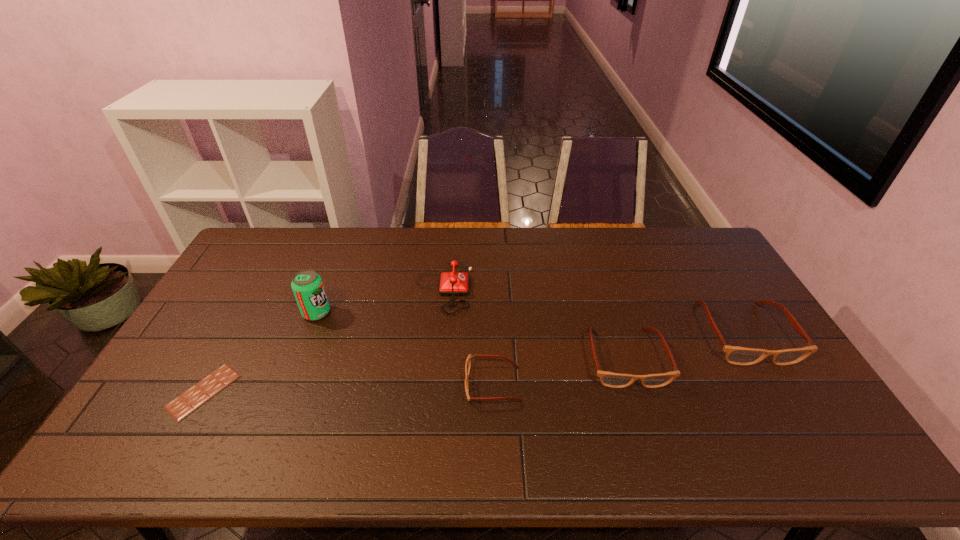
Image resolution: width=960 pixels, height=540 pixels. In order to click on chocolate bar that is at the near edge in this screenshot , I will do `click(197, 395)`.

Where is `object present at the left edge`? Image resolution: width=960 pixels, height=540 pixels. object present at the left edge is located at coordinates (197, 395).

The width and height of the screenshot is (960, 540). Find the location of `object present at the right edge`. object present at the right edge is located at coordinates (736, 355).

Where is `object situated at the near left corner`? Image resolution: width=960 pixels, height=540 pixels. object situated at the near left corner is located at coordinates (197, 395).

You are a GUI agent. You are given a task and a screenshot of the screen. Output one action in this format:
    pyautogui.click(x=<x>, y=<y>)
    Task: Click on the free space at the far edge of the desktop
    The height and width of the screenshot is (540, 960).
    Given the screenshot: What is the action you would take?
    pyautogui.click(x=309, y=232)

What are the coordinates of `free location at the near edge of the desktop` in the screenshot? It's located at (468, 406).

This screenshot has height=540, width=960. I want to click on vacant area at the left edge, so [218, 305].

In the image, there is a desktop. Where is `free region at the far left corner`? The height and width of the screenshot is (540, 960). free region at the far left corner is located at coordinates (276, 247).

Locate an element on the screen. The height and width of the screenshot is (540, 960). free space at the far right corner of the desktop is located at coordinates (693, 235).

In order to click on vacant point at the near right corner in this screenshot , I will do (x=806, y=426).